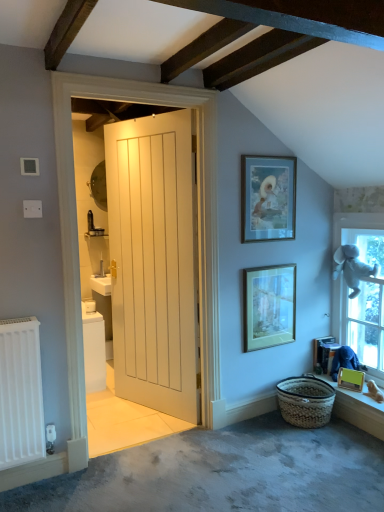
Find the location of a particular element. blank space to the left of braided straw basket at lower right is located at coordinates [x=261, y=430].